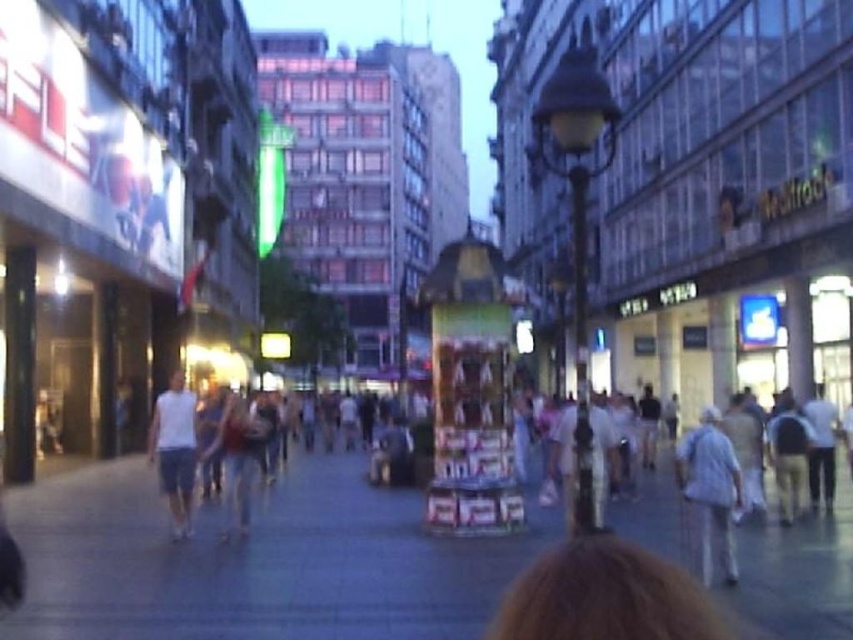
You are a delivery drone flying over an urban area. You need to land on the gray concrete sidewalk at center. According to the coordinates provided, where exactly should you aim to land?

The gray concrete sidewalk at center is located at coordinates point (256, 561), so you should aim for that exact point to land safely.

You are a photographer standing at the center of the street. You want to take a photo that includes both the point at coordinates point(318, 472) and point(732, 545). Given their positions, which point will appear closer to the camera in your photo?

Point(318, 472) is further to the camera than point(732, 545), so in the photo, point(318, 472) will appear closer to the camera than point(732, 545).